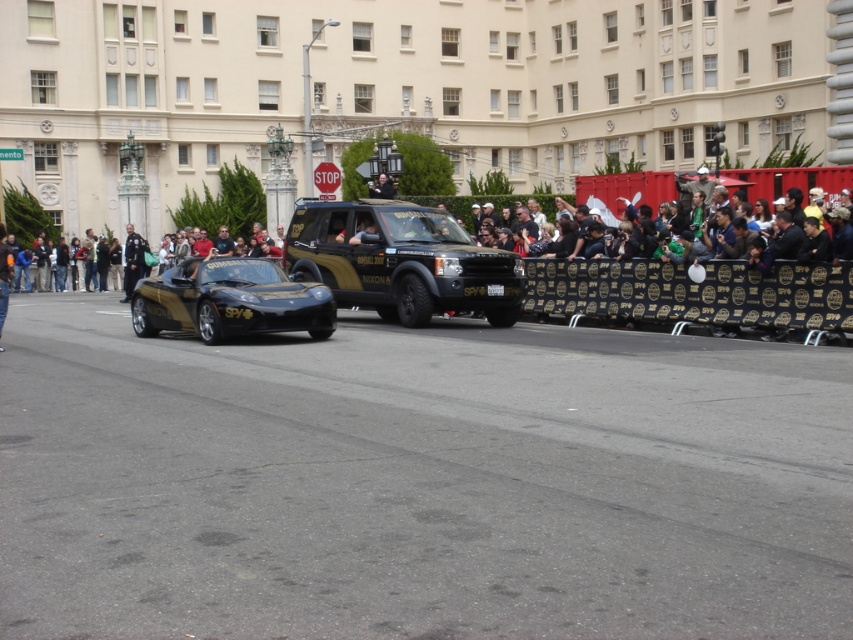
Looking at this image, which of these two, dark gray fabric crowd at center or black leather jacket at center, stands taller?

With more height is dark gray fabric crowd at center.

The width and height of the screenshot is (853, 640). What do you see at coordinates (625, 189) in the screenshot? I see `dark gray fabric crowd at center` at bounding box center [625, 189].

Where is `dark gray fabric crowd at center`? dark gray fabric crowd at center is located at coordinates (625, 189).

Is gold matte jeep at center closer to the viewer compared to dark gray fabric crowd at center?

That is True.

Can you confirm if gold matte jeep at center is bigger than dark gray fabric crowd at center?

No.

Locate an element on the screen. gold matte jeep at center is located at coordinates (401, 260).

Identify the location of gold matte jeep at center. (401, 260).

Is black leather jacket at center above gold metallic helmet at center?

No, black leather jacket at center is not above gold metallic helmet at center.

Find the location of `black leather jacket at center`. black leather jacket at center is located at coordinates (4, 273).

I want to click on black leather jacket at center, so click(4, 273).